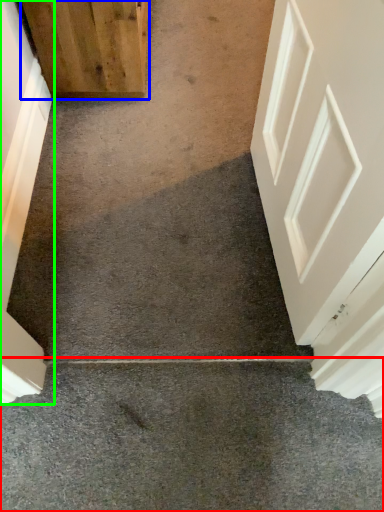
Question: Which is nearer to the concrete (highlighted by a red box)? door (highlighted by a blue box) or door (highlighted by a green box).

Choices:
 (A) door
 (B) door

Answer: (B)